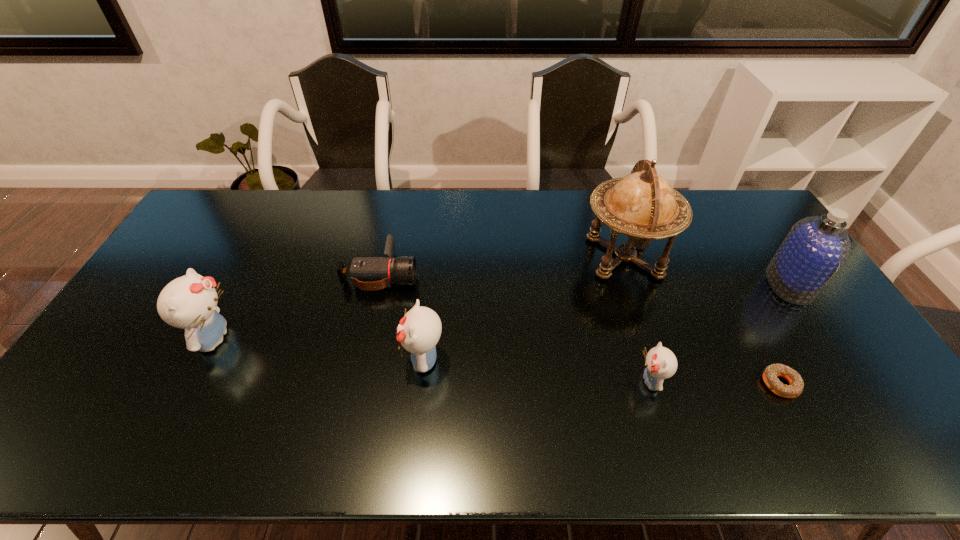
All kittens are currently evenly spaced. To continue this pattern, where would you add another kitten on the right? Please point out a vacant spot. Please provide its 2D coordinates. Your answer should be formatted as a tuple, i.e. [(x, y)], where the tuple contains the x and y coordinates of a point satisfying the conditions above.

[(897, 405)]